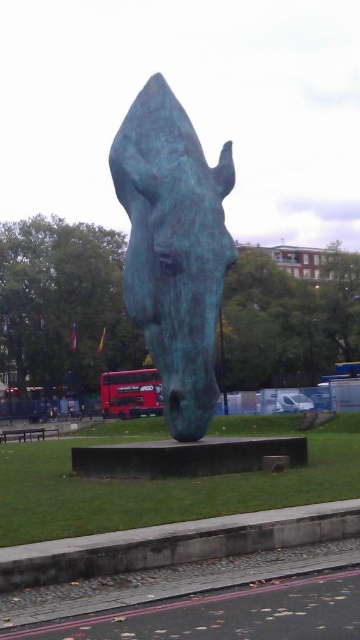
You are a photographer trying to capture the bronze horse head at center and the red metallic bus at center in the same frame. Which object should you focus on first if you want to emphasize their size difference in your composition?

You should focus on the bronze horse head at center first because it is larger than the red metallic bus at center, allowing you to highlight their size contrast effectively.

You are an artist planning to photograph the bronze horse head at center and the red metallic bus at center from a distance. Based on their sizes, which object will appear larger in the photo?

The bronze horse head at center will appear larger in the photo because its width is larger than the red metallic bus at center.

You are standing in front of the sculpture and want to move from point A to point B. Point A is at coordinates point (125,173) and point B is at coordinates point (144,374). Which direction should you move to go from point A to point B?

To move from point A to point B, you should move backward since point A is in front of point B according to the coordinates provided.